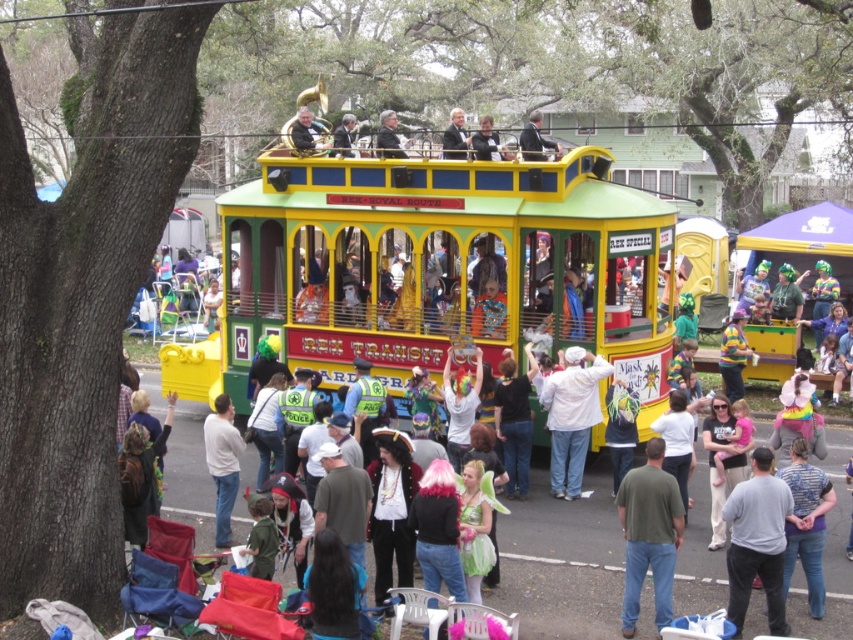
You are standing at the point marked as point [218,477] and want to take a photo of the trolley car. To get a better angle, you decide to move to the point marked as point [730,524]. Will moving to this new position make the trolley car appear larger in your photo?

Yes, moving to point [730,524] will make the trolley car appear larger in your photo because this point is closer to the camera than point [218,477].

You are a photographer at the festival. You want to take a photo of the gray cotton shirt at center and the formal black suit at upper center. Which of the two is shorter?

The gray cotton shirt at center is shorter than the formal black suit at upper center.

You are a photographer standing in the crowd at the parade. You want to take a photo that includes both the green matte shirt at center and the white matte shirt at center. Given that your camera has a maximum focus range of 5 meters, will you be able to capture both subjects in focus?

The distance between the green matte shirt at center and the white matte shirt at center is 4.74 meters, which is within the camera maximum focus range of 5 meters. Therefore, you can capture both subjects in focus.